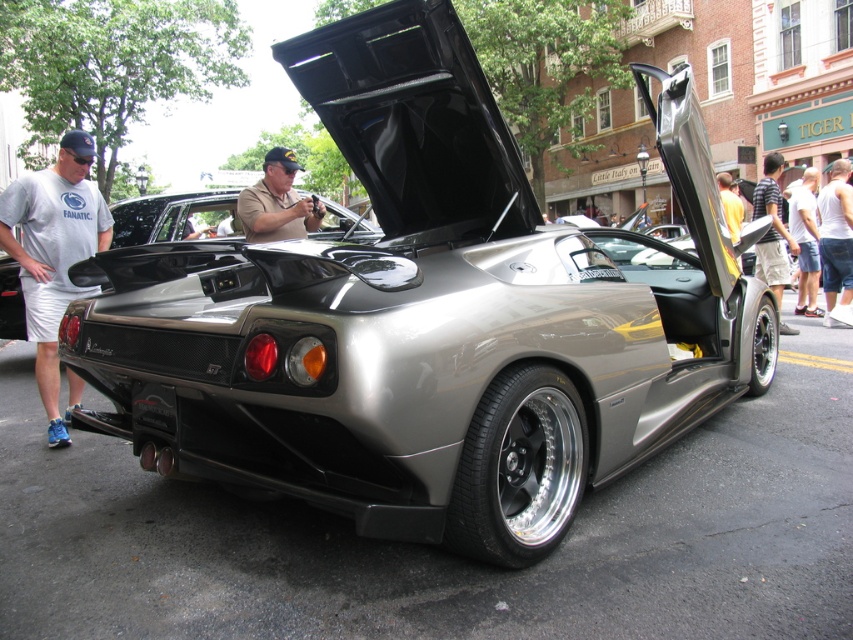
Question: Is gray fabric shirt at left to the right of white cotton tank top at center from the viewer's perspective?

Choices:
 (A) yes
 (B) no

Answer: (B)

Question: Does gray fabric shirt at left appear under white cotton shirt at right?

Choices:
 (A) no
 (B) yes

Answer: (B)

Question: Among these objects, which one is farthest from the camera?

Choices:
 (A) striped shirt at center
 (B) white cotton shirt at right
 (C) khaki uniform at center
 (D) white cotton tank top at center

Answer: (B)

Question: Observing the image, what is the correct spatial positioning of khaki uniform at center in reference to white cotton tank top at center?

Choices:
 (A) left
 (B) right

Answer: (A)

Question: Which point is closer to the camera?

Choices:
 (A) khaki uniform at center
 (B) white cotton tank top at center

Answer: (A)

Question: Which point is farther to the camera?

Choices:
 (A) khaki uniform at center
 (B) striped shirt at center
 (C) white cotton tank top at center

Answer: (C)